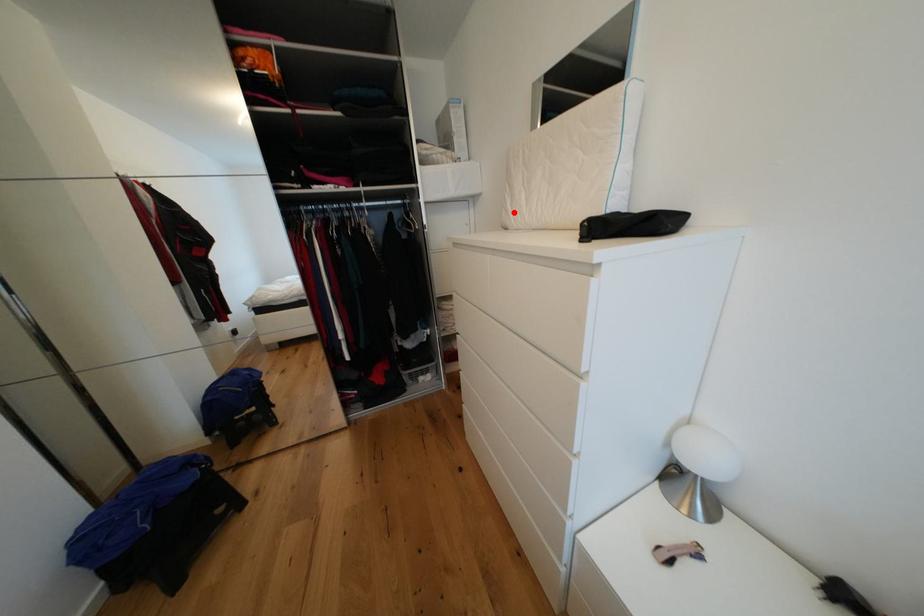
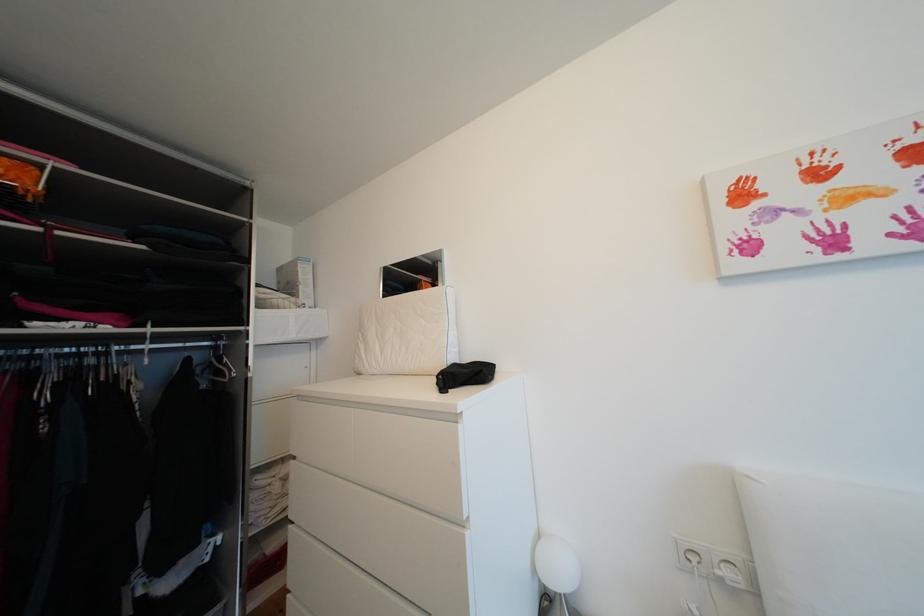
Find the pixel in the second image that matches the highlighted location in the first image.

(368, 359)